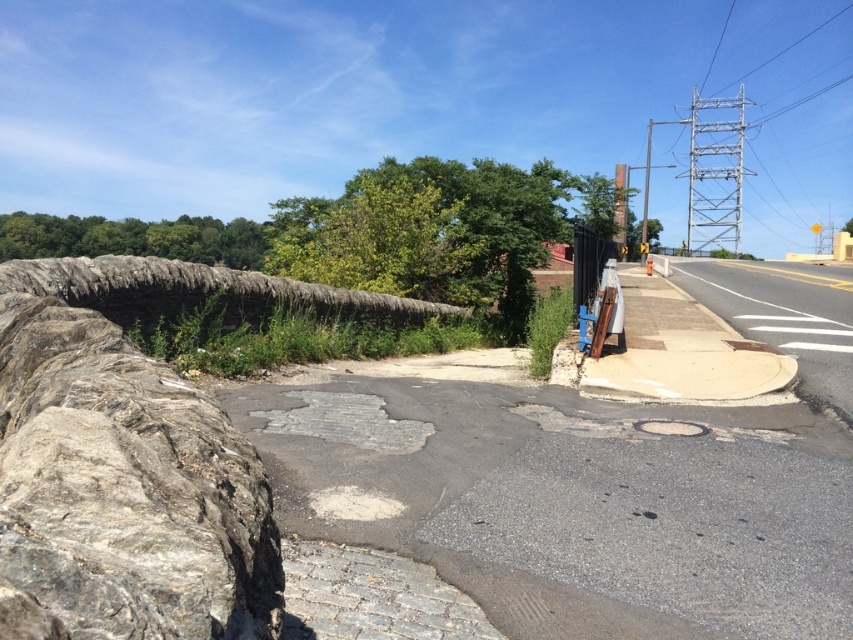
Question: Can you confirm if gray rough stone at left is positioned to the right of metallic gray pole at upper right?

Choices:
 (A) no
 (B) yes

Answer: (A)

Question: Is the position of gray rough stone at left more distant than that of metallic gray pole at upper right?

Choices:
 (A) no
 (B) yes

Answer: (A)

Question: Can you confirm if gray rough stone at left is wider than metallic gray pole at upper right?

Choices:
 (A) no
 (B) yes

Answer: (A)

Question: Which of the following is the closest to the observer?

Choices:
 (A) gray rough stone at left
 (B) metallic gray pole at upper right

Answer: (A)